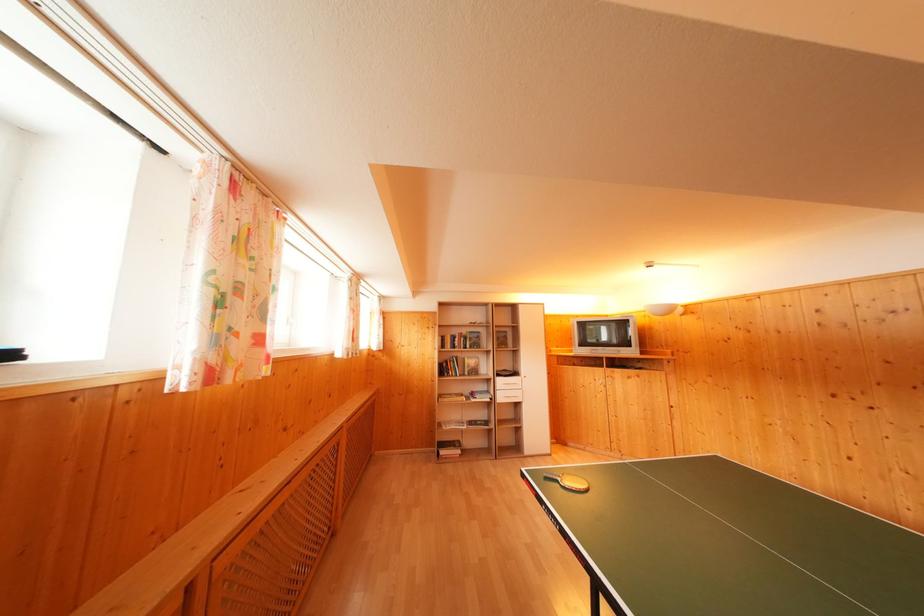
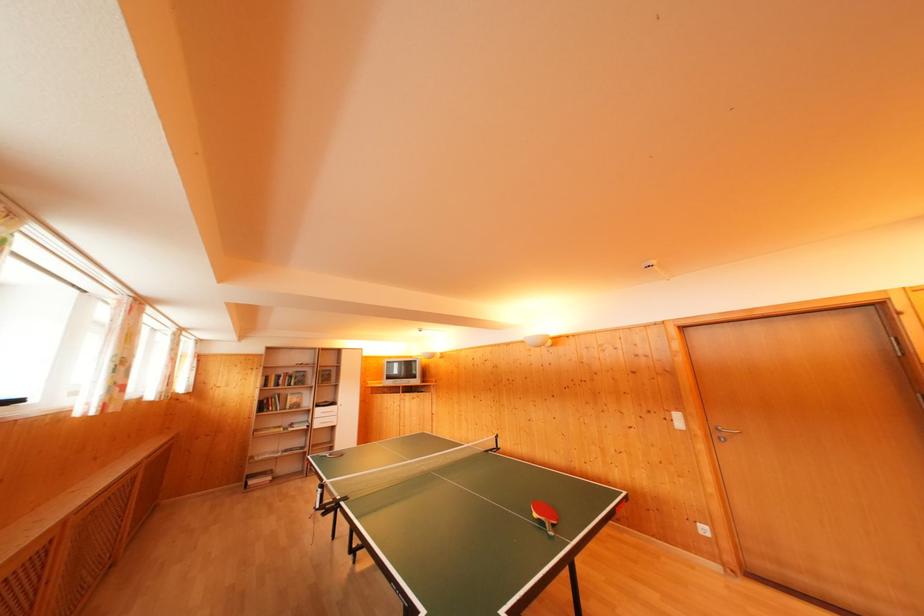
Where in the second image is the point corresponding to (x=459, y=337) from the first image?

(286, 377)